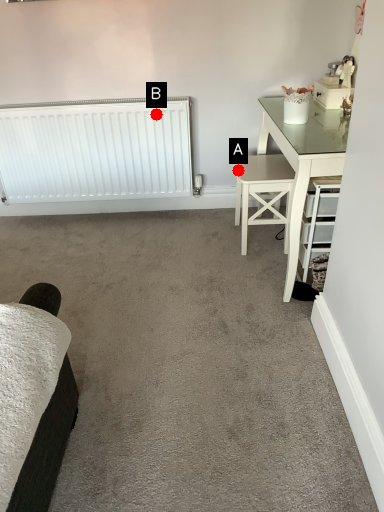
Question: Two points are circled on the image, labeled by A and B beside each circle. Which point is closer to the camera?

Choices:
 (A) A is closer
 (B) B is closer

Answer: (A)